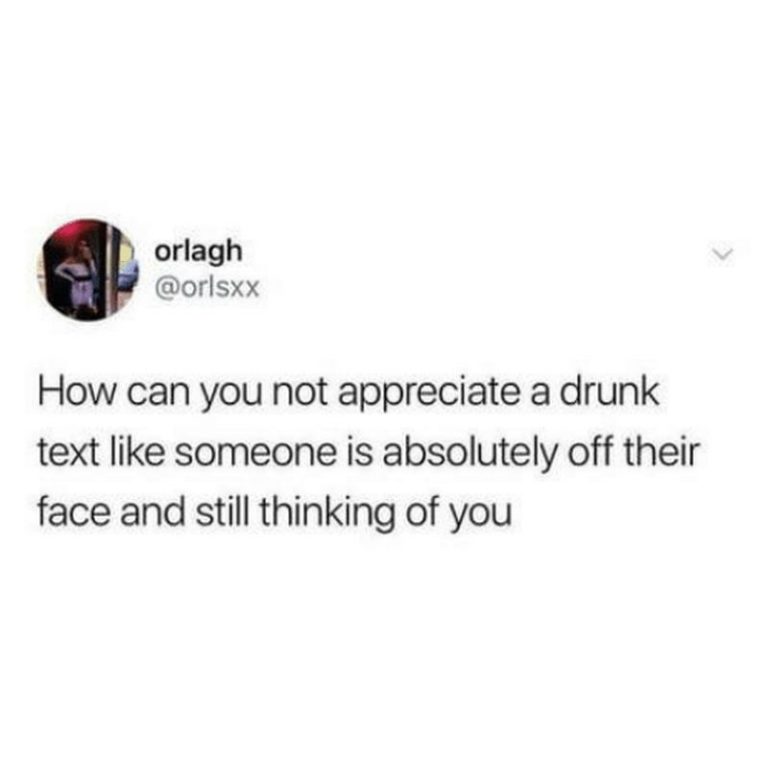
Locate an element on the screen. red pink light is located at coordinates (67, 230).